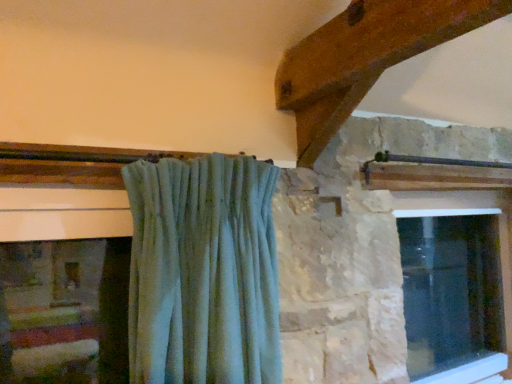
Describe the element at coordinates (452, 296) in the screenshot. I see `clear glass window at center` at that location.

The image size is (512, 384). Identify the location of clear glass window at center. (452, 296).

Identify the location of clear glass window at center. This screenshot has width=512, height=384. (452, 296).